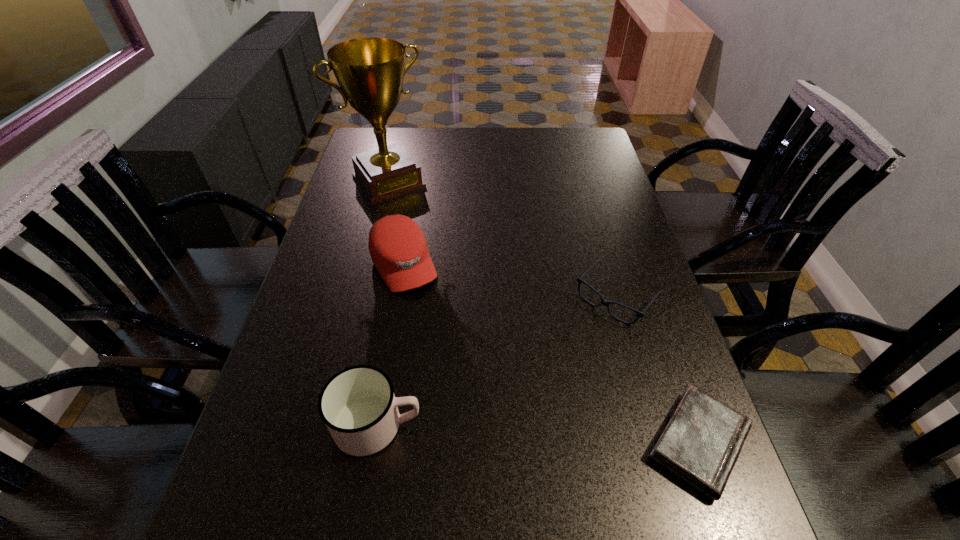
I want to click on free space on the desktop that is between the mug and the shortest object and is positioned on the front-facing side of the spectacles, so click(498, 431).

You are a GUI agent. You are given a task and a screenshot of the screen. Output one action in this format:
    pyautogui.click(x=<x>, y=<y>)
    Task: Click on the vacant space on the desktop that is between the mug and the shortest object and is positioned on the front-facing side of the cap
    
    Given the screenshot: What is the action you would take?
    pyautogui.click(x=498, y=431)

Where is `free space on the desktop that is between the mug and the shortest object and is positioned on the plaque of the tallest object`? The height and width of the screenshot is (540, 960). free space on the desktop that is between the mug and the shortest object and is positioned on the plaque of the tallest object is located at coordinates (579, 436).